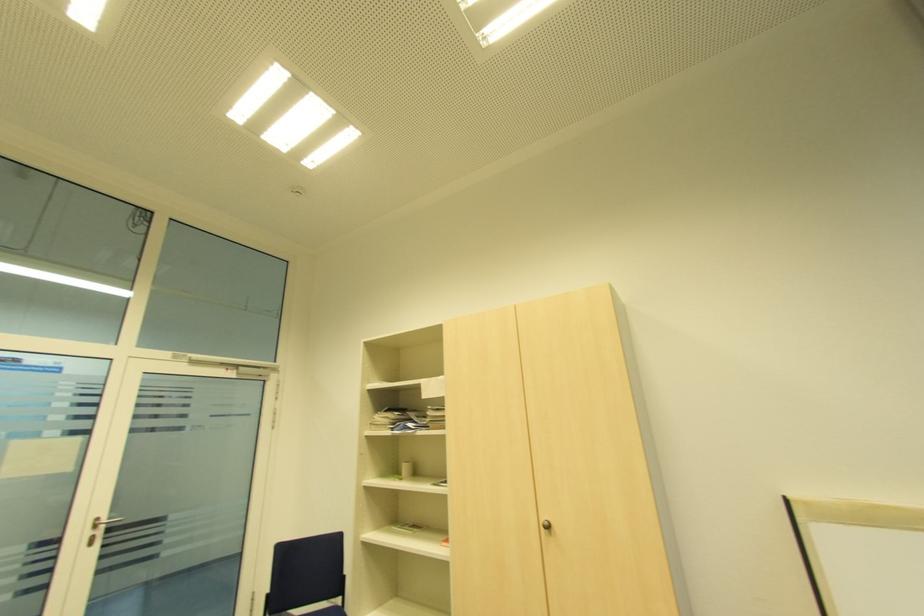
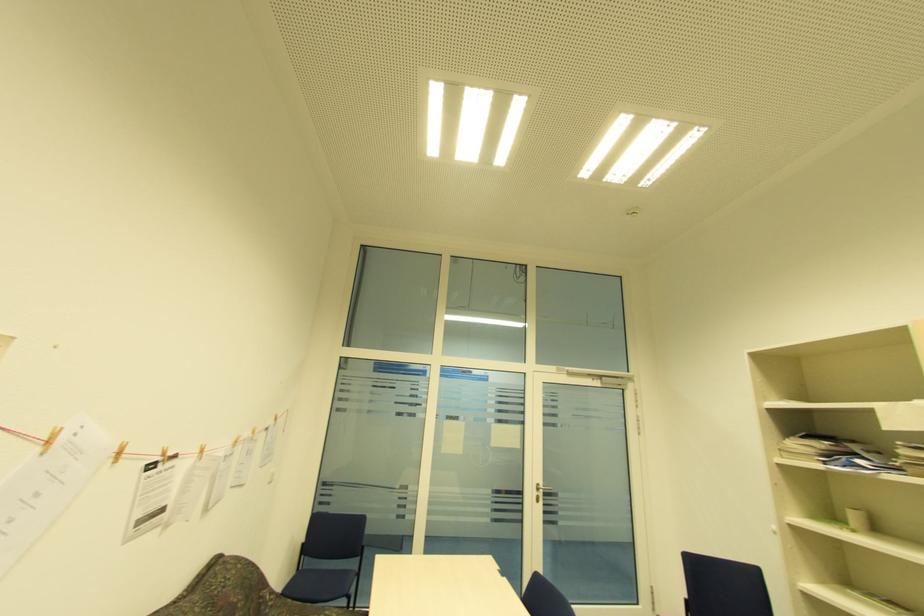
Where in the second image is the point corresponding to the point at 407,467 from the first image?

(857, 517)